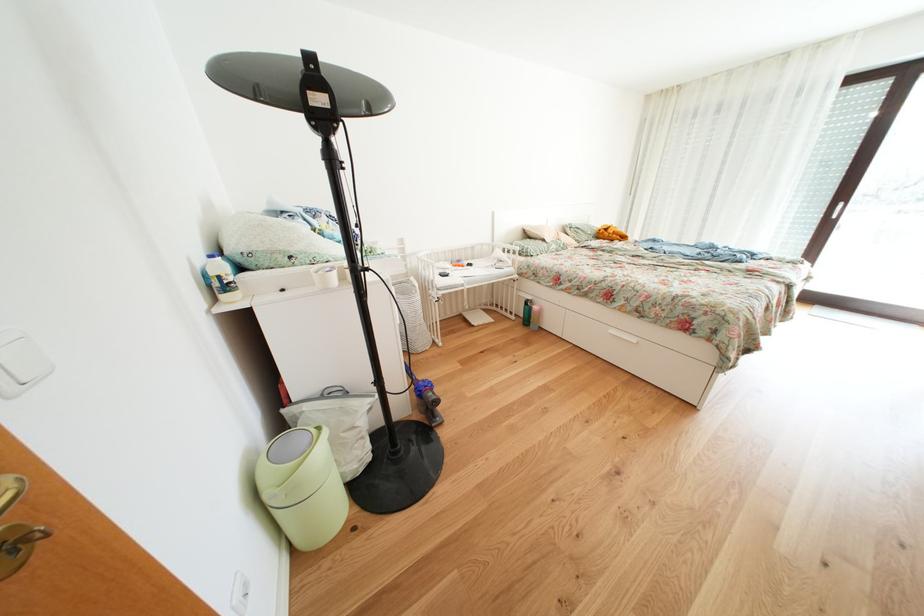
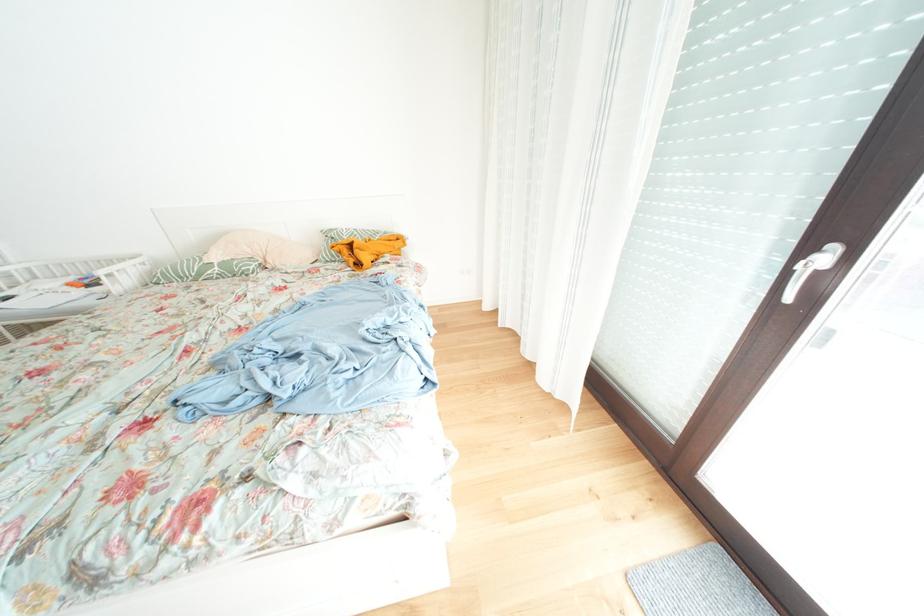
The images are taken continuously from a first-person perspective. In which direction are you moving?

The cameraman moved toward right, forward.